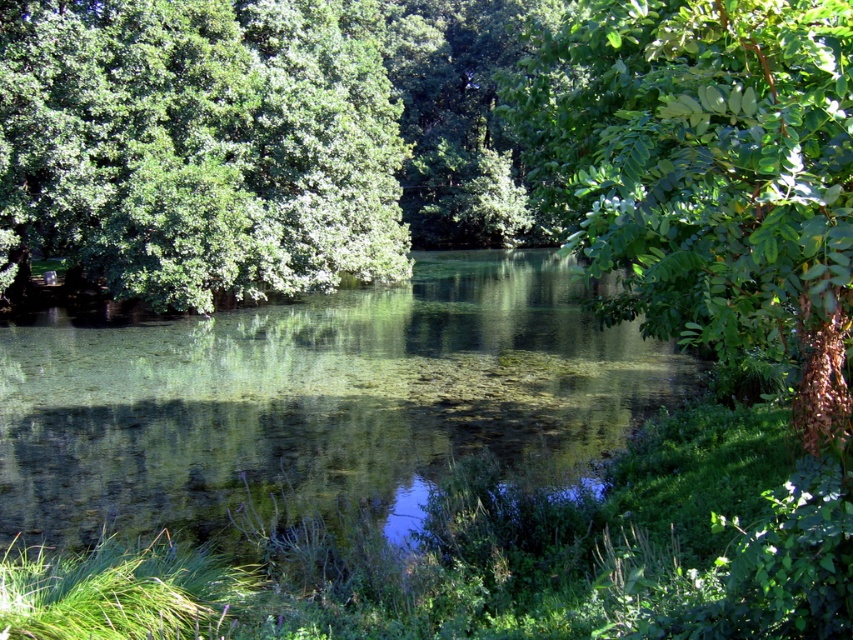
Does clear water at center have a smaller size compared to green leafy tree at upper right?

Yes.

Measure the distance between point (556,285) and camera.

49.52 meters

The image size is (853, 640). I want to click on clear water at center, so click(317, 401).

Can you confirm if clear water at center is positioned to the left of green leafy tree at center?

In fact, clear water at center is to the right of green leafy tree at center.

Does clear water at center have a greater height compared to green leafy tree at center?

No, clear water at center is not taller than green leafy tree at center.

At what (x,y) coordinates should I click in order to perform the action: click on clear water at center. Please return your answer as a coordinate pair (x, y). Looking at the image, I should click on (317, 401).

Between green leafy tree at center and green leafy tree at upper right, which one has less height?

Standing shorter between the two is green leafy tree at upper right.

How distant is green leafy tree at center from green leafy tree at upper right?

green leafy tree at center and green leafy tree at upper right are 13.02 meters apart.

Who is more distant from viewer, (271, 36) or (704, 316)?

Positioned behind is point (271, 36).

At what (x,y) coordinates should I click in order to perform the action: click on green leafy tree at center. Please return your answer as a coordinate pair (x, y). This screenshot has width=853, height=640. Looking at the image, I should click on (199, 145).